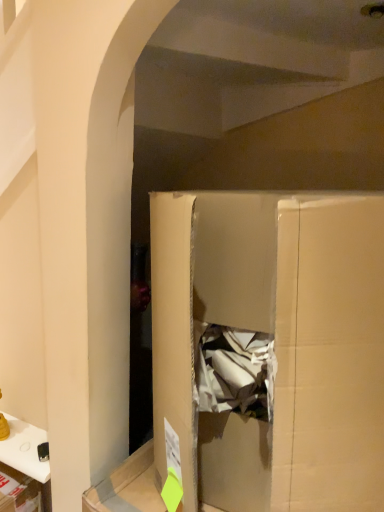
Question: Is cardboard box at center to the left or to the right of white glossy phone at lower left in the image?

Choices:
 (A) left
 (B) right

Answer: (B)

Question: From a real-world perspective, is cardboard box at center above or below white glossy phone at lower left?

Choices:
 (A) below
 (B) above

Answer: (B)

Question: From the image's perspective, relative to white glossy phone at lower left, is cardboard box at center above or below?

Choices:
 (A) below
 (B) above

Answer: (B)

Question: Would you say white glossy phone at lower left is to the left or to the right of cardboard box at center in the picture?

Choices:
 (A) left
 (B) right

Answer: (A)

Question: In the image, is white glossy phone at lower left positioned in front of or behind cardboard box at center?

Choices:
 (A) front
 (B) behind

Answer: (B)

Question: From the image's perspective, relative to cardboard box at center, is white glossy phone at lower left above or below?

Choices:
 (A) below
 (B) above

Answer: (A)

Question: Is white glossy phone at lower left taller or shorter than cardboard box at center?

Choices:
 (A) short
 (B) tall

Answer: (A)